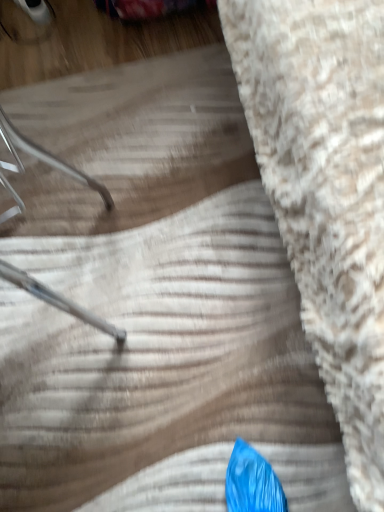
The width and height of the screenshot is (384, 512). Find the location of `metallic silver chair at left`. metallic silver chair at left is located at coordinates (43, 158).

Describe the element at coordinates (43, 158) in the screenshot. I see `metallic silver chair at left` at that location.

In order to face metallic silver chair at left, should I rotate leftwards or rightwards?

Turn left by 24.919 degrees to look at metallic silver chair at left.

I want to click on metallic silver chair at left, so click(x=43, y=158).